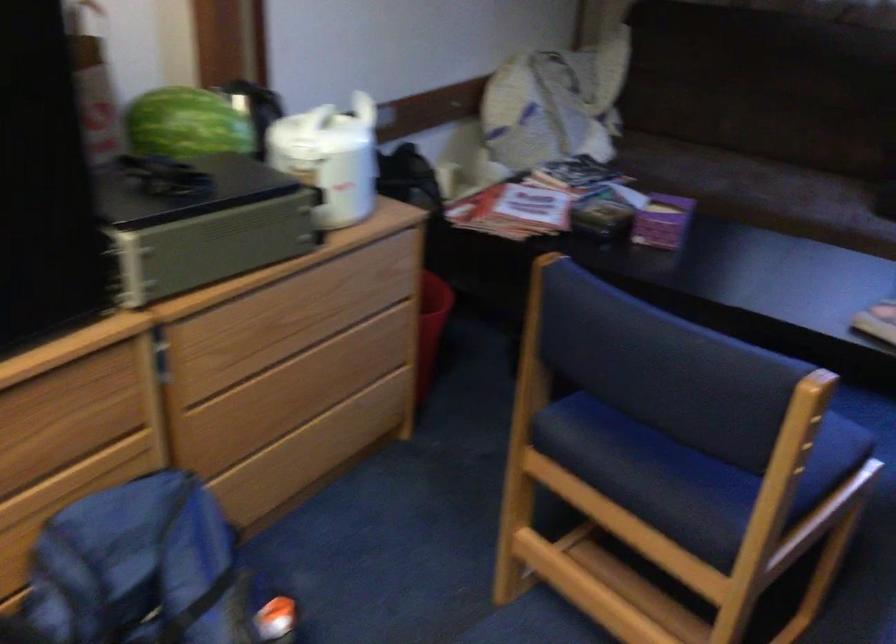
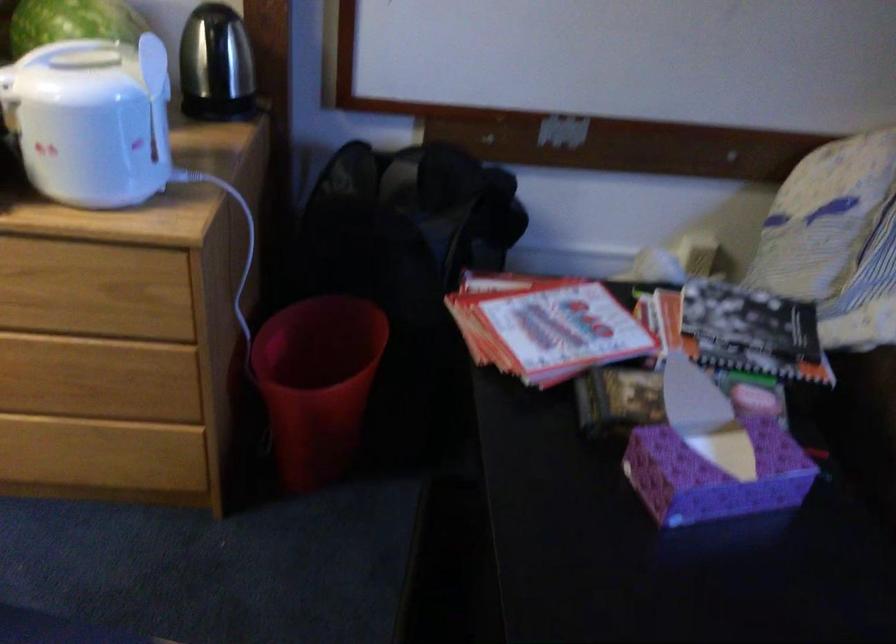
Find the pixel in the second image that matches point 673,216 in the first image.

(714, 475)